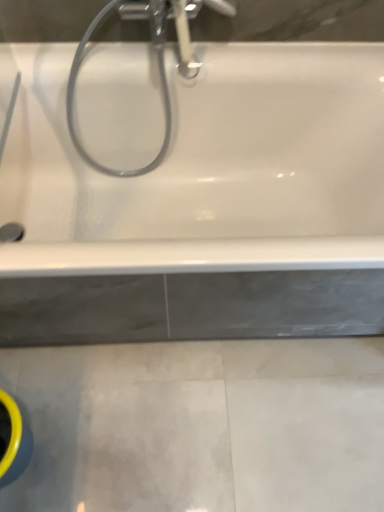
You are a GUI agent. You are given a task and a screenshot of the screen. Output one action in this format:
    pyautogui.click(x=<x>, y=<y>)
    Task: Click on the chrome metallic showerhead at upper center
    This screenshot has width=384, height=512.
    Given the screenshot: What is the action you would take?
    pyautogui.click(x=157, y=58)

Considering the positions of objects white glossy bathtub at upper center and chrome metallic showerhead at upper center in the image provided, who is more to the right, white glossy bathtub at upper center or chrome metallic showerhead at upper center?

white glossy bathtub at upper center is more to the right.

Which of these two, white glossy bathtub at upper center or chrome metallic showerhead at upper center, is smaller?

With smaller size is chrome metallic showerhead at upper center.

In terms of width, does white glossy bathtub at upper center look wider or thinner when compared to chrome metallic showerhead at upper center?

white glossy bathtub at upper center is wider than chrome metallic showerhead at upper center.

Does white glossy bathtub at upper center turn towards chrome metallic showerhead at upper center?

No.

Which object is thinner, white glossy bathtub at upper center or satin nickel faucet at upper center?

satin nickel faucet at upper center is thinner.

From a real-world perspective, between white glossy bathtub at upper center and satin nickel faucet at upper center, who is vertically higher?

satin nickel faucet at upper center, from a real-world perspective.

Does white glossy bathtub at upper center come in front of satin nickel faucet at upper center?

Yes, white glossy bathtub at upper center is closer to the viewer.

From the image's perspective, is chrome metallic showerhead at upper center located above white glossy bathtub at upper center?

Correct, chrome metallic showerhead at upper center appears higher than white glossy bathtub at upper center in the image.

From the picture: Which object is positioned more to the right, chrome metallic showerhead at upper center or white glossy bathtub at upper center?

Positioned to the right is white glossy bathtub at upper center.

Which of these two, chrome metallic showerhead at upper center or white glossy bathtub at upper center, stands shorter?

white glossy bathtub at upper center.

How many degrees apart are the facing directions of chrome metallic showerhead at upper center and white glossy bathtub at upper center?

There is a 0.123-degree angle between the facing directions of chrome metallic showerhead at upper center and white glossy bathtub at upper center.

Considering the relative positions of satin nickel faucet at upper center and chrome metallic showerhead at upper center in the image provided, is satin nickel faucet at upper center behind chrome metallic showerhead at upper center?

That is True.

Which object is thinner, satin nickel faucet at upper center or chrome metallic showerhead at upper center?

chrome metallic showerhead at upper center.

Who is shorter, satin nickel faucet at upper center or chrome metallic showerhead at upper center?

satin nickel faucet at upper center.

Is satin nickel faucet at upper center turned away from chrome metallic showerhead at upper center?

Yes, chrome metallic showerhead at upper center is at the back of satin nickel faucet at upper center.

Can you confirm if chrome metallic showerhead at upper center is thinner than satin nickel faucet at upper center?

Indeed, chrome metallic showerhead at upper center has a lesser width compared to satin nickel faucet at upper center.

Locate an element on the screen. The height and width of the screenshot is (512, 384). plumbing fixture in front of the satin nickel faucet at upper center is located at coordinates (157, 58).

Who is smaller, chrome metallic showerhead at upper center or satin nickel faucet at upper center?

satin nickel faucet at upper center.

Looking at this image, is there a large distance between chrome metallic showerhead at upper center and satin nickel faucet at upper center?

They are positioned close to each other.

Are satin nickel faucet at upper center and white glossy bathtub at upper center located far from each other?

No, satin nickel faucet at upper center is in close proximity to white glossy bathtub at upper center.

Is satin nickel faucet at upper center positioned beyond the bounds of white glossy bathtub at upper center?

Indeed, satin nickel faucet at upper center is completely outside white glossy bathtub at upper center.

Consider the image. From a real-world perspective, does satin nickel faucet at upper center stand above white glossy bathtub at upper center?

Yes, from a real-world perspective, satin nickel faucet at upper center is over white glossy bathtub at upper center

Is satin nickel faucet at upper center wider than white glossy bathtub at upper center?

In fact, satin nickel faucet at upper center might be narrower than white glossy bathtub at upper center.

The image size is (384, 512). In order to click on plumbing fixture that appears above the white glossy bathtub at upper center (from a real-world perspective) in this screenshot , I will do `click(157, 58)`.

You are a GUI agent. You are given a task and a screenshot of the screen. Output one action in this format:
    pyautogui.click(x=<x>, y=<y>)
    Task: Click on the tap on the left of the white glossy bathtub at upper center
    
    Given the screenshot: What is the action you would take?
    click(175, 23)

Which object lies further to the anchor point white glossy bathtub at upper center, satin nickel faucet at upper center or chrome metallic showerhead at upper center?

Among the two, satin nickel faucet at upper center is located further to white glossy bathtub at upper center.

When comparing their distances from satin nickel faucet at upper center, does chrome metallic showerhead at upper center or white glossy bathtub at upper center seem further?

white glossy bathtub at upper center is positioned further to the anchor satin nickel faucet at upper center.

From the image, which object appears to be farther from chrome metallic showerhead at upper center, white glossy bathtub at upper center or satin nickel faucet at upper center?

The object further to chrome metallic showerhead at upper center is white glossy bathtub at upper center.

From the image, which object appears to be nearer to satin nickel faucet at upper center, white glossy bathtub at upper center or chrome metallic showerhead at upper center?

chrome metallic showerhead at upper center lies closer to satin nickel faucet at upper center than the other object.

Considering their positions, is chrome metallic showerhead at upper center positioned closer to white glossy bathtub at upper center than satin nickel faucet at upper center?

chrome metallic showerhead at upper center.

Based on their spatial positions, is satin nickel faucet at upper center or white glossy bathtub at upper center further from chrome metallic showerhead at upper center?

white glossy bathtub at upper center is further to chrome metallic showerhead at upper center.

At what (x,y) coordinates should I click in order to perform the action: click on plumbing fixture that lies between satin nickel faucet at upper center and white glossy bathtub at upper center from top to bottom. Please return your answer as a coordinate pair (x, y). The height and width of the screenshot is (512, 384). Looking at the image, I should click on (157, 58).